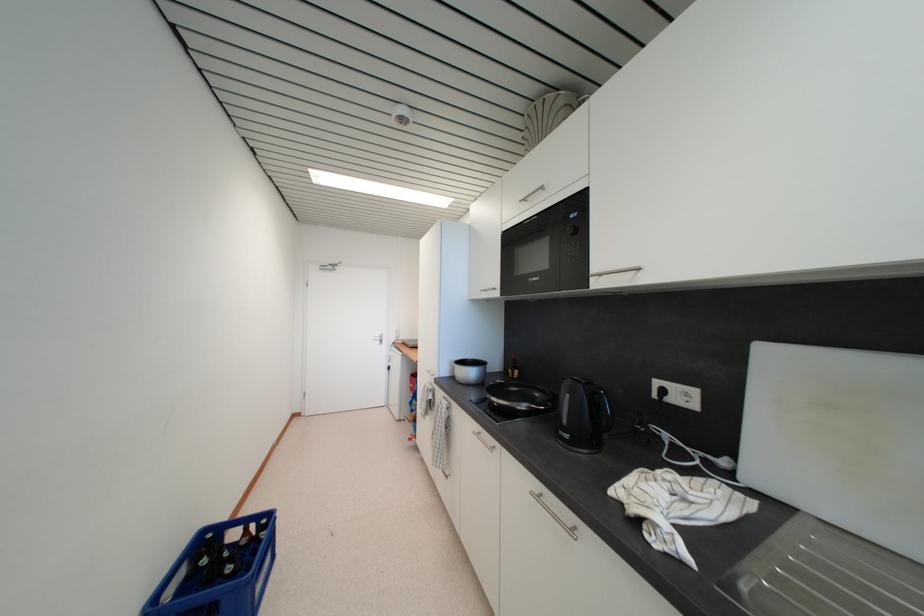
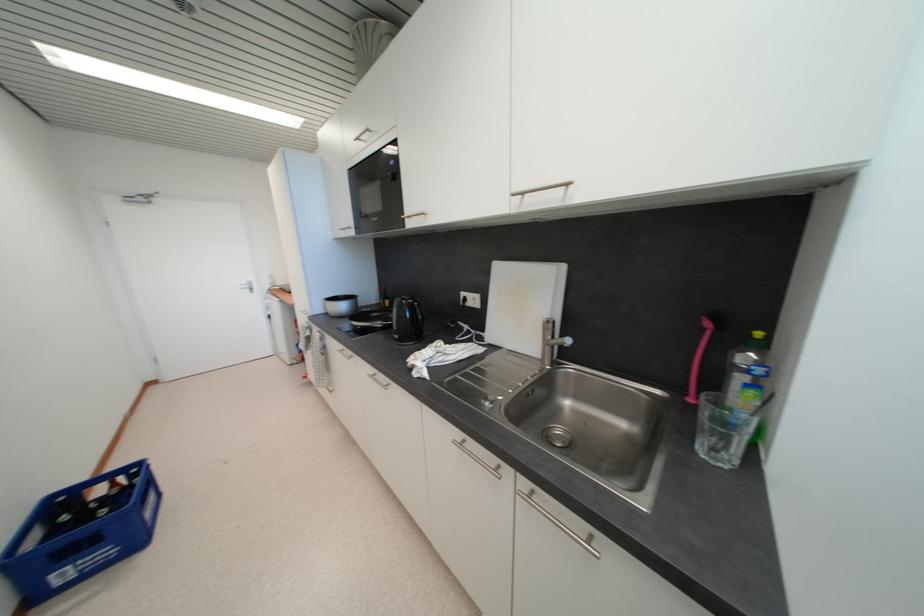
Where in the second image is the point corresponding to [572,439] from the first image?

(402, 339)